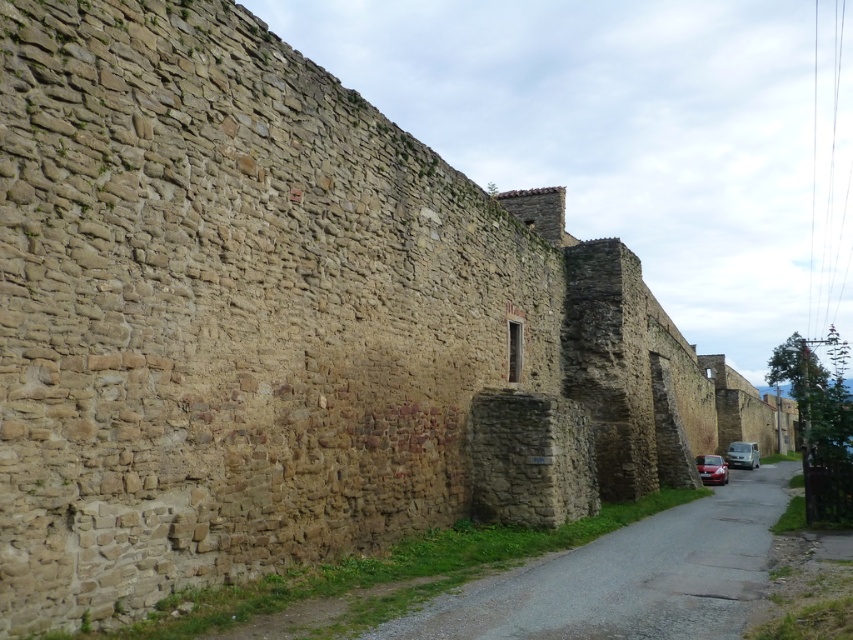
Question: Among these objects, which one is farthest from the camera?

Choices:
 (A) smooth stone wall at center
 (B) shiny red car at lower right

Answer: (B)

Question: Is smooth stone wall at center smaller than silver metallic van at center-right?

Choices:
 (A) yes
 (B) no

Answer: (B)

Question: Can you confirm if smooth stone wall at center is thinner than silver metallic van at center-right?

Choices:
 (A) yes
 (B) no

Answer: (B)

Question: Which point appears farthest from the camera in this image?

Choices:
 (A) (767, 516)
 (B) (732, 451)
 (C) (709, 472)

Answer: (B)

Question: Which point is farther from the camera taking this photo?

Choices:
 (A) (704, 458)
 (B) (671, 561)
 (C) (757, 451)

Answer: (C)

Question: Is smooth stone wall at center closer to camera compared to shiny red car at lower right?

Choices:
 (A) yes
 (B) no

Answer: (A)